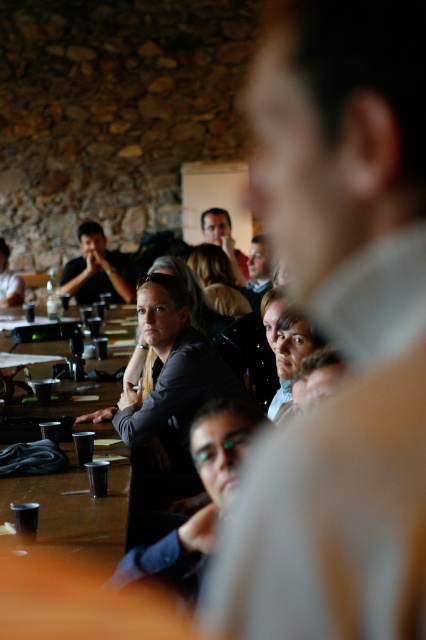
You are standing at the entrance of the room and notice the brown wooden table at lower left. Based on its position coordinates, can you determine if it is closer to the left or right wall of the room?

The brown wooden table at lower left is located at point (x=75, y=508). Since the x coordinate is closer to 1, it is closer to the right wall of the room.

Looking at this image, you are organizing a small event and need to place a decorative centerpiece on the brown wooden table at lower left. Considering the space it occupies, will there be enough room for the centerpiece if the matte black shirt at center is already occupying its current position?

The brown wooden table at lower left occupies less space than the matte black shirt at center, so placing a decorative centerpiece might be challenging due to limited space.